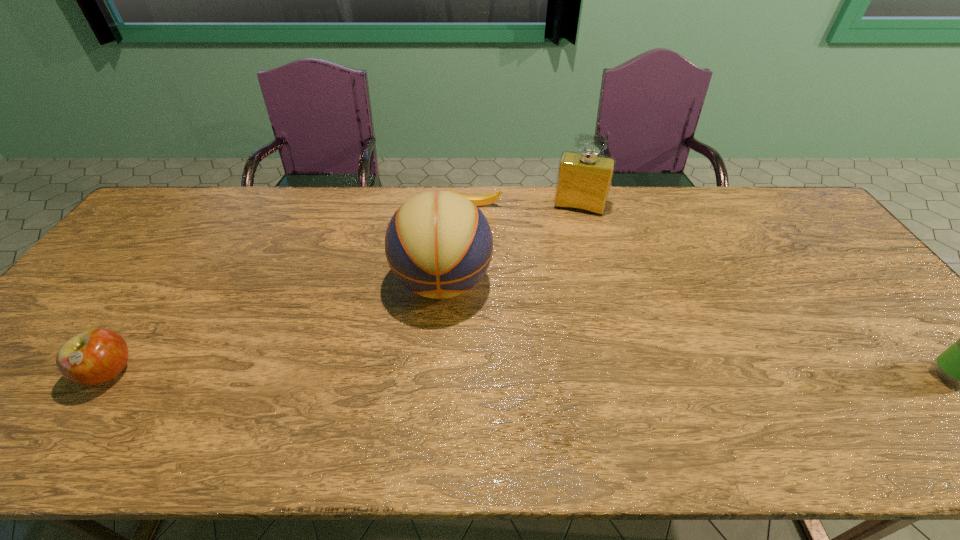
Where is `free space in the image that satisfies the following two spatial constraints: 1. on the back side of the third nearest object; 2. on the right side of the second object from right to left`? This screenshot has width=960, height=540. free space in the image that satisfies the following two spatial constraints: 1. on the back side of the third nearest object; 2. on the right side of the second object from right to left is located at coordinates coord(449,207).